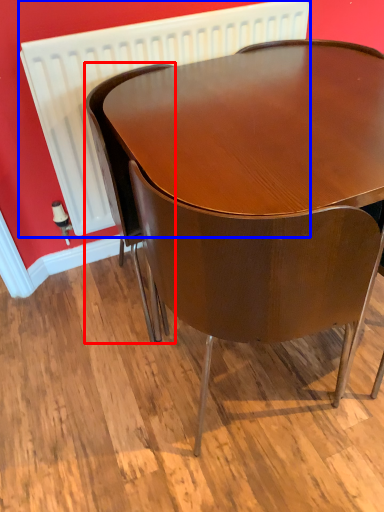
Question: Which object is further to the camera taking this photo, chair (highlighted by a red box) or radiator (highlighted by a blue box)?

Choices:
 (A) chair
 (B) radiator

Answer: (B)